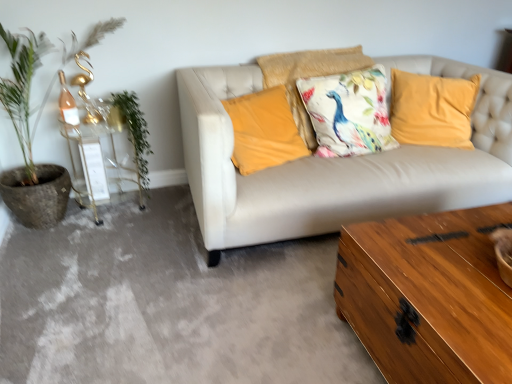
Where is `vacant area that is in front of clear glass side table at left`? This screenshot has height=384, width=512. vacant area that is in front of clear glass side table at left is located at coordinates (104, 231).